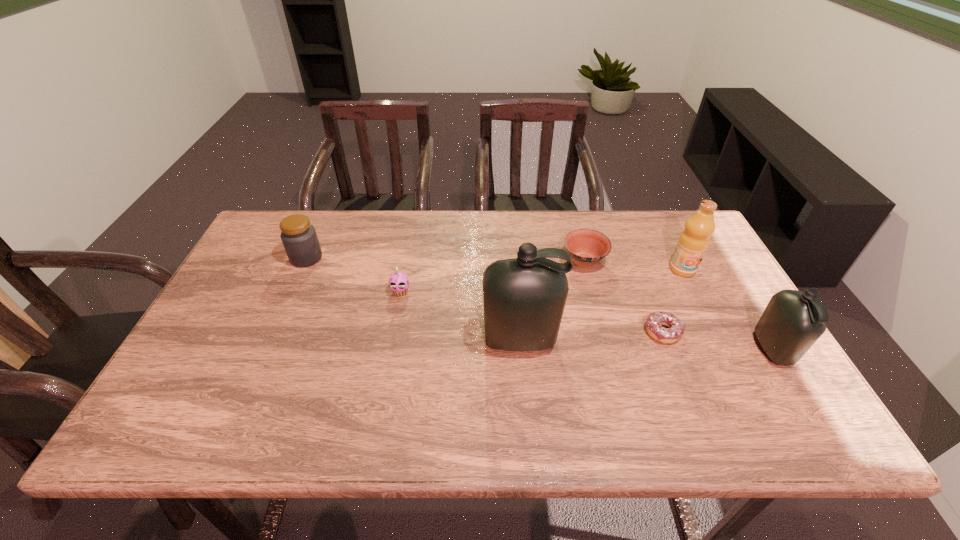
Where is `the third object from right to left`? This screenshot has height=540, width=960. the third object from right to left is located at coordinates (676, 328).

This screenshot has width=960, height=540. I want to click on doughnut, so click(x=676, y=328).

This screenshot has width=960, height=540. I want to click on the sixth object from left to right, so click(x=694, y=240).

The width and height of the screenshot is (960, 540). Find the location of `blank area located on the left of the tallest object`. blank area located on the left of the tallest object is located at coordinates (426, 340).

Find the location of a particular element. The image size is (960, 540). free space located 0.230m on the left of the shorter bottle is located at coordinates (662, 349).

Where is `vacant area situated on the face of the cupcake`? vacant area situated on the face of the cupcake is located at coordinates (392, 342).

This screenshot has height=540, width=960. What are the coordinates of `vacant space located 0.090m on the right of the bowl` in the screenshot? It's located at (636, 261).

Find the location of `vacant space located on the surface of the fourth tallest object near the warning symbol`. vacant space located on the surface of the fourth tallest object near the warning symbol is located at coordinates (421, 258).

In order to click on vacant area located on the back of the shortest object in this screenshot , I will do `click(640, 275)`.

This screenshot has width=960, height=540. Identify the location of vacant space located 0.210m on the front label of the fruit juice. (715, 335).